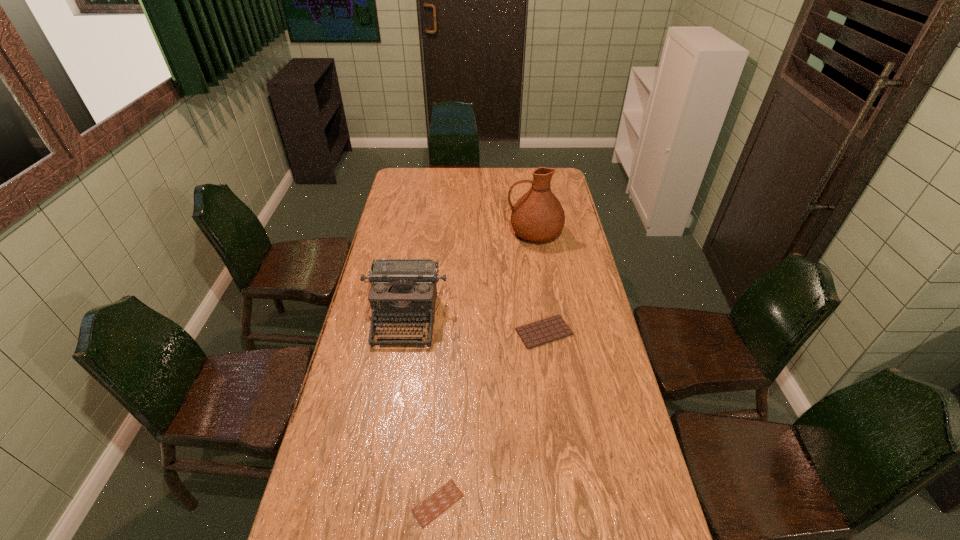
I want to click on vacant space located on the typing side of the typewriter, so click(x=395, y=384).

This screenshot has height=540, width=960. Find the location of `vacant space located on the left of the taller chocolate bar`. vacant space located on the left of the taller chocolate bar is located at coordinates (405, 332).

At what (x,y) coordinates should I click in order to perform the action: click on free space located on the right of the shortest object. Please return your answer as a coordinate pair (x, y). Looking at the image, I should click on (576, 503).

The width and height of the screenshot is (960, 540). In order to click on object at the left edge in this screenshot , I will do `click(403, 289)`.

Identify the location of pitcher present at the right edge. The width and height of the screenshot is (960, 540). (537, 216).

What are the coordinates of `chocolate bar situated at the right edge` in the screenshot? It's located at (550, 329).

Locate an element on the screen. This screenshot has width=960, height=540. vacant space at the far edge is located at coordinates (492, 171).

Locate an element on the screen. The height and width of the screenshot is (540, 960). free space at the left edge of the desktop is located at coordinates (394, 247).

Where is `free region at the right edge`? The image size is (960, 540). free region at the right edge is located at coordinates [x=591, y=285].

This screenshot has width=960, height=540. I want to click on empty space between the second shortest object and the tallest object, so click(x=540, y=282).